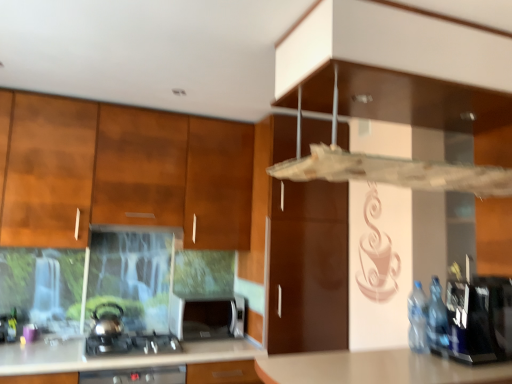
Identify the location of vacant region above transparent plastic vent at upper center (from a real-world perspective). The width and height of the screenshot is (512, 384). [x=403, y=110].